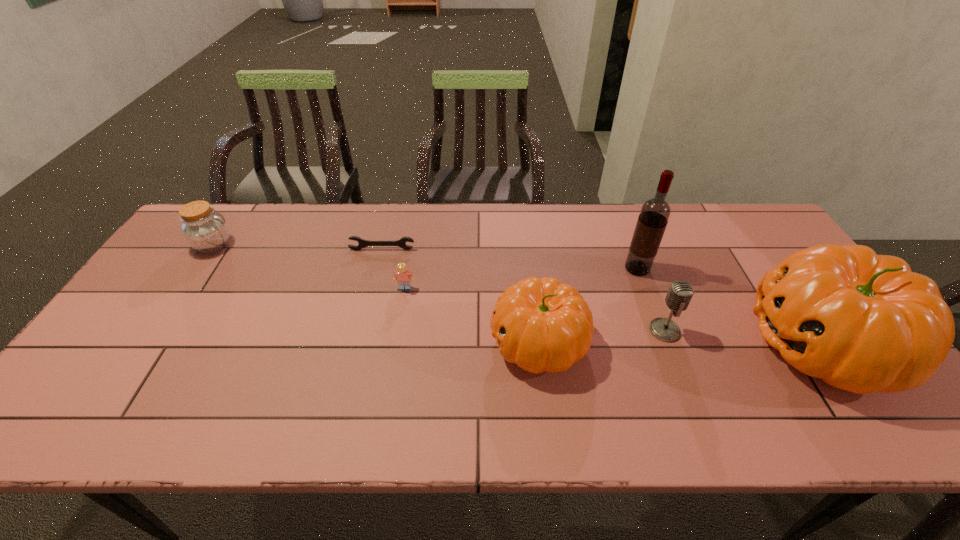
With all pumpkins evenly spaced, where should an extra pumpkin be placed on the left to continue the pattern? Please point out a vacant space. Please provide its 2D coordinates. Your answer should be formatted as a tuple, i.e. [(x, y)], where the tuple contains the x and y coordinates of a point satisfying the conditions above.

[(258, 340)]